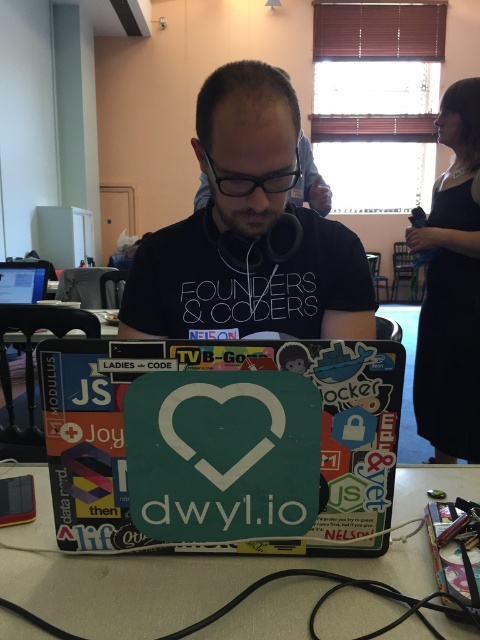
You are standing in front of the scene described. You want to place a 22 inch wide laptop bag on the floor. Can you fit it between the matte black table at lower center and your current position?

The distance between the matte black table at lower center and the viewer is 21.99 inches. Since the laptop bag is 22 inches wide, it will not fit as the space is slightly narrower than the bag.

Based on the photo, you are organizing a small event and need to place a 1.5 meter long banner on the table. Given the dimensions of the matte black table at lower center and the black dress at right, can the banner fit on the table?

The matte black table at lower center is wider than the black dress at right, so the banner may fit depending on the table length. However, the description only mentions width comparison, not length. Check the table length before placing the banner.